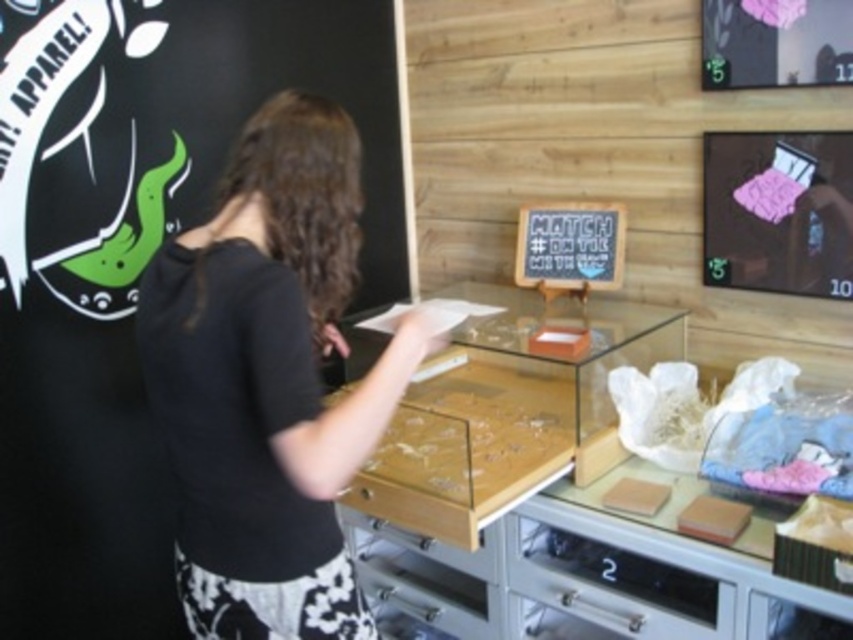
Can you confirm if black matte shirt at center is wider than black chalkboard at center?

Indeed, black matte shirt at center has a greater width compared to black chalkboard at center.

Based on the photo, can you confirm if black matte shirt at center is taller than black chalkboard at center?

Yes.

Describe the element at coordinates (267, 381) in the screenshot. I see `black matte shirt at center` at that location.

This screenshot has height=640, width=853. I want to click on black matte shirt at center, so click(x=267, y=381).

Based on the photo, which is below, black matte shirt at center or metallic silver drawer at lower center?

metallic silver drawer at lower center

Who is higher up, black matte shirt at center or metallic silver drawer at lower center?

black matte shirt at center is higher up.

I want to click on black matte shirt at center, so click(267, 381).

Can you confirm if metallic silver drawer at lower center is positioned above black chalkboard at center?

No, metallic silver drawer at lower center is not above black chalkboard at center.

Who is positioned more to the right, metallic silver drawer at lower center or black chalkboard at center?

metallic silver drawer at lower center is more to the right.

Between point (576, 572) and point (532, 285), which one is positioned in front?

Positioned in front is point (576, 572).

At what (x,y) coordinates should I click in order to perform the action: click on metallic silver drawer at lower center. Please return your answer as a coordinate pair (x, y). The height and width of the screenshot is (640, 853). Looking at the image, I should click on (614, 584).